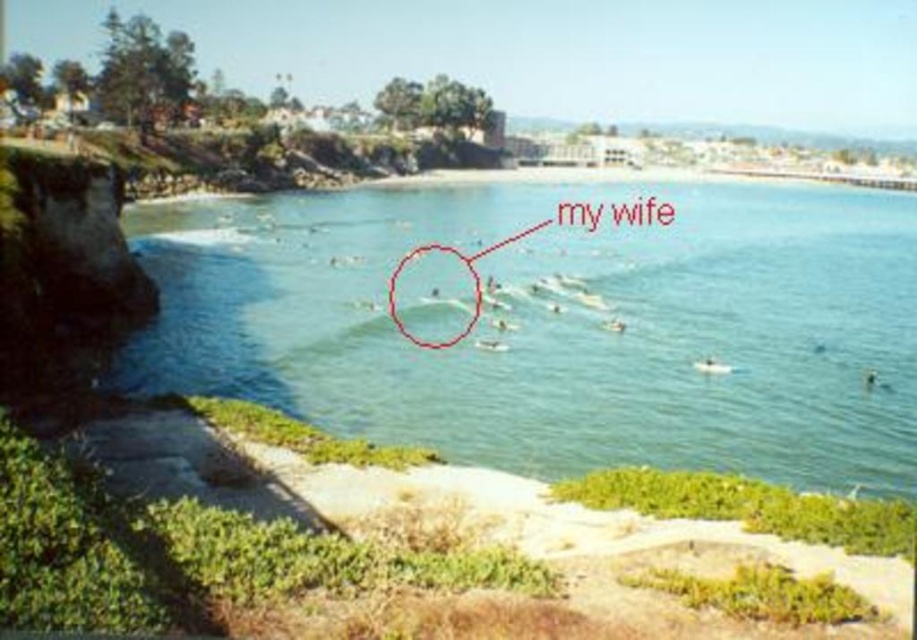
Does clear blue water at center appear on the right side of smooth white surfboard at center?

Indeed, clear blue water at center is positioned on the right side of smooth white surfboard at center.

Is point (489, 202) closer to camera compared to point (396, 266)?

No, (489, 202) is behind (396, 266).

This screenshot has height=640, width=917. I want to click on clear blue water at center, so click(x=560, y=324).